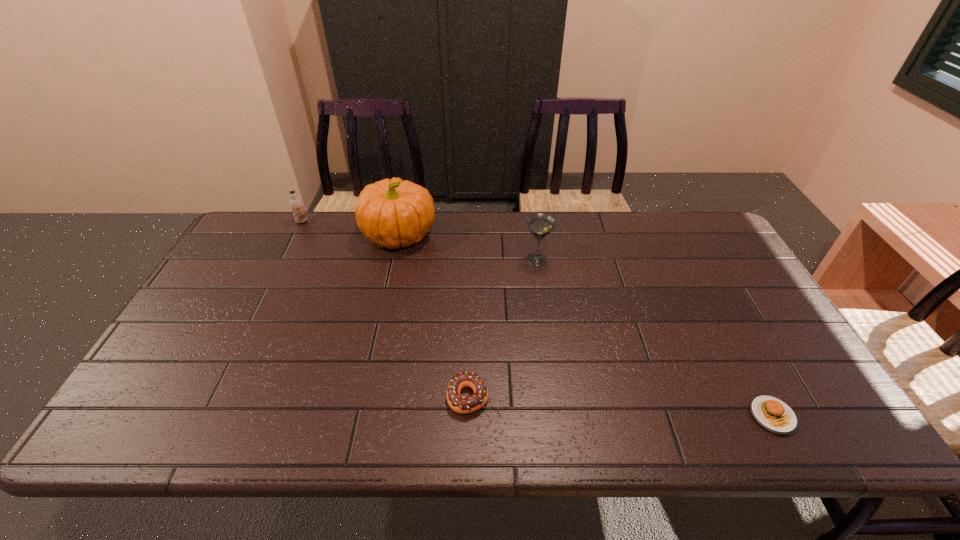
This screenshot has width=960, height=540. I want to click on vacant space situated on the surface of the tallest object, so click(x=500, y=235).

The image size is (960, 540). Find the location of `free region located on the front of the second object from right to left`. free region located on the front of the second object from right to left is located at coordinates (553, 373).

Identify the location of vacant space located 0.140m on the front of the third tallest object. The width and height of the screenshot is (960, 540). (287, 252).

Locate an element on the screen. This screenshot has height=540, width=960. vacant space situated on the back of the doughnut is located at coordinates (469, 307).

The height and width of the screenshot is (540, 960). Find the location of `free space located on the back of the shortest object`. free space located on the back of the shortest object is located at coordinates (751, 375).

I want to click on pumpkin at the far edge, so click(x=391, y=213).

Locate an element on the screen. martini located in the far edge section of the desktop is located at coordinates (540, 225).

Find the location of a particular element. chocolate milk at the far edge is located at coordinates (296, 204).

Identify the location of doughnut that is at the near edge. The height and width of the screenshot is (540, 960). (463, 405).

Identify the location of food located at the near edge. (773, 414).